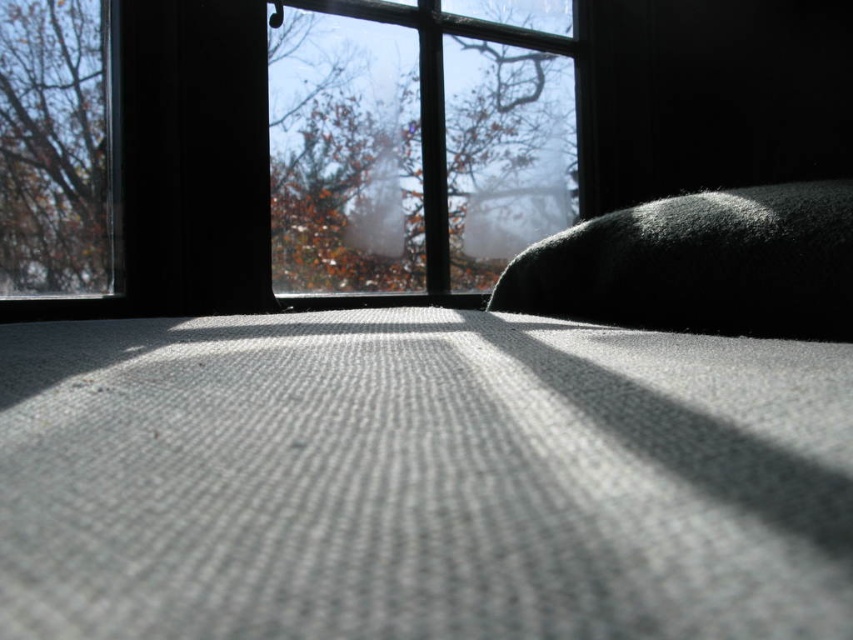
Measure the distance between black fuzzy pillow at right and brown leafy tree at upper left.

black fuzzy pillow at right is 1.39 meters away from brown leafy tree at upper left.

Is point (699, 193) closer to camera compared to point (91, 120)?

That is False.

Who is more forward, (792, 225) or (77, 292)?

Point (792, 225) is more forward.

Locate an element on the screen. The height and width of the screenshot is (640, 853). black fuzzy pillow at right is located at coordinates (700, 264).

Does point (44, 285) lie in front of point (837, 205)?

That is False.

Is transparent glass window at upper center above black fuzzy pillow at right?

Correct, transparent glass window at upper center is located above black fuzzy pillow at right.

Is point (231, 264) in front of point (711, 328)?

No, it is behind (711, 328).

The height and width of the screenshot is (640, 853). Identify the location of transparent glass window at upper center. (287, 154).

Between transparent glass window at upper center and brown leafy tree at upper left, which one appears on the left side from the viewer's perspective?

brown leafy tree at upper left is more to the left.

Between point (108, 316) and point (20, 196), which one is positioned in front?

Positioned in front is point (20, 196).

Is point (422, 112) positioned in front of point (1, 170)?

That is False.

Locate an element on the screen. transparent glass window at upper center is located at coordinates pos(287,154).